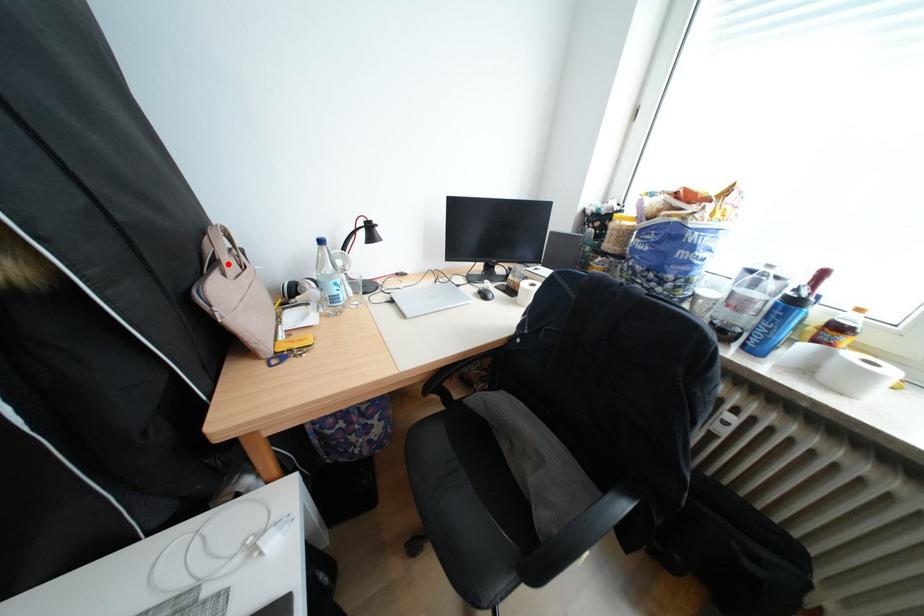
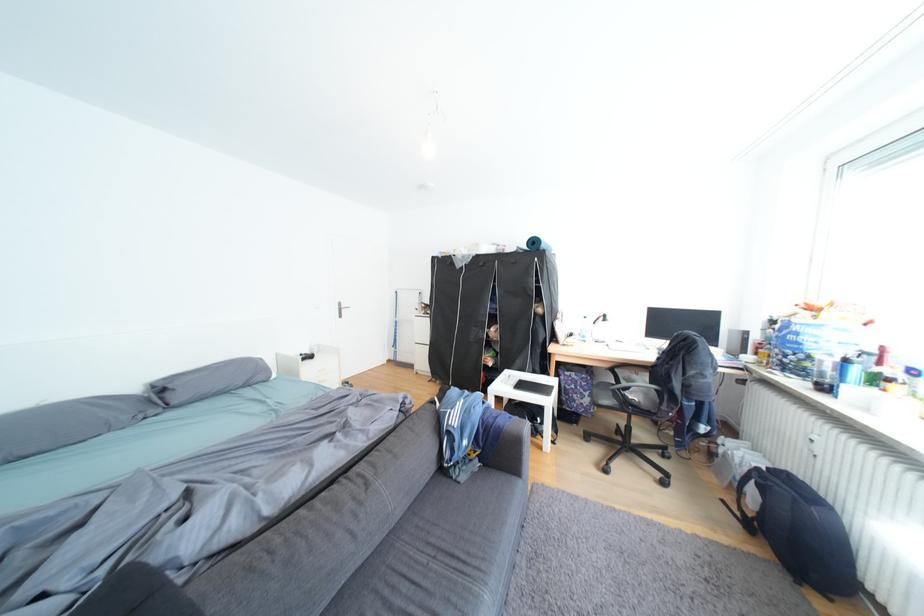
Question: A red point is marked in image1. In image2, is the corresponding 3D point closer to the camera or farther? Reply with the corresponding letter.

Choices:
 (A) The corresponding 3D point is closer.
 (B) The corresponding 3D point is farther.

Answer: (B)